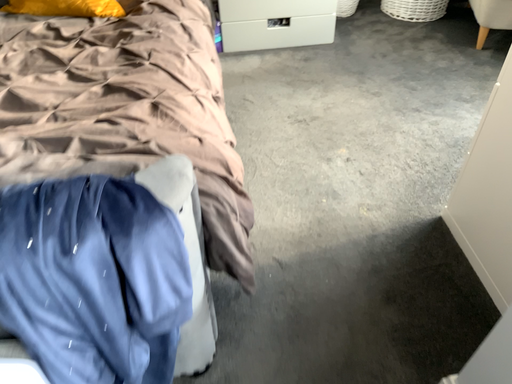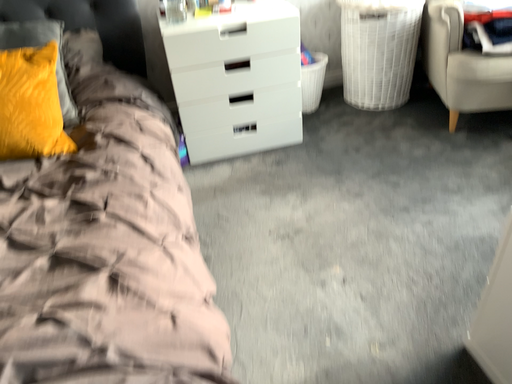
Question: Which way did the camera rotate in the video?

Choices:
 (A) rotated downward
 (B) rotated upward

Answer: (B)